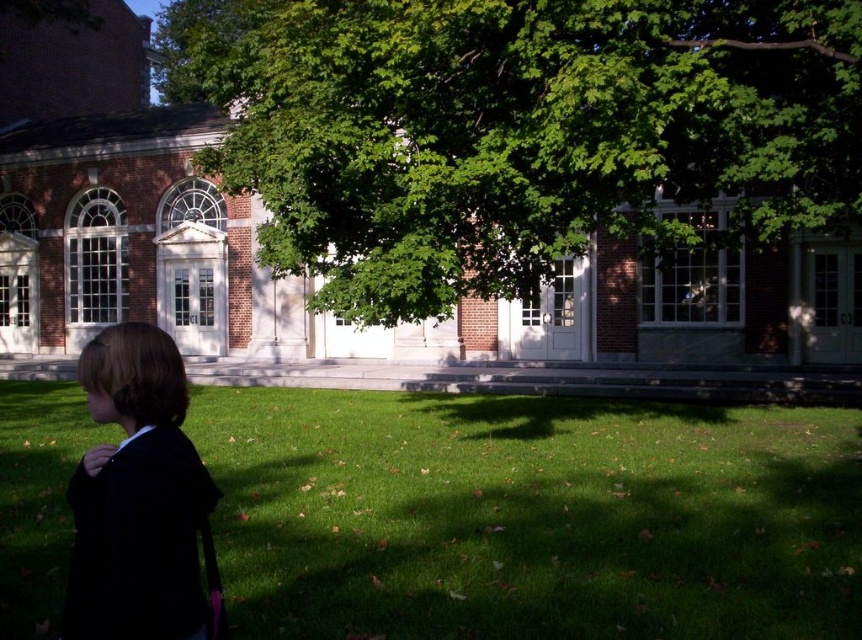
Is green leafy tree at center smaller than black fabric jacket at lower left?

No.

Does green leafy tree at center appear on the left side of black fabric jacket at lower left?

Indeed, green leafy tree at center is positioned on the left side of black fabric jacket at lower left.

The image size is (862, 640). Find the location of `green leafy tree at center`. green leafy tree at center is located at coordinates (514, 131).

Between green grass at lower left and black fabric jacket at lower left, which one appears on the right side from the viewer's perspective?

green grass at lower left is more to the right.

How far apart are green grass at lower left and black fabric jacket at lower left?

A distance of 5.64 meters exists between green grass at lower left and black fabric jacket at lower left.

Which is in front, point (17, 461) or point (183, 563)?

Point (183, 563) is in front.

Locate an element on the screen. green grass at lower left is located at coordinates (529, 516).

Can you confirm if green grass at lower left is smaller than green leafy tree at center?

Indeed, green grass at lower left has a smaller size compared to green leafy tree at center.

Is point (429, 534) positioned before point (792, 170)?

Yes, point (429, 534) is in front of point (792, 170).

The height and width of the screenshot is (640, 862). What are the coordinates of `green grass at lower left` in the screenshot? It's located at (529, 516).